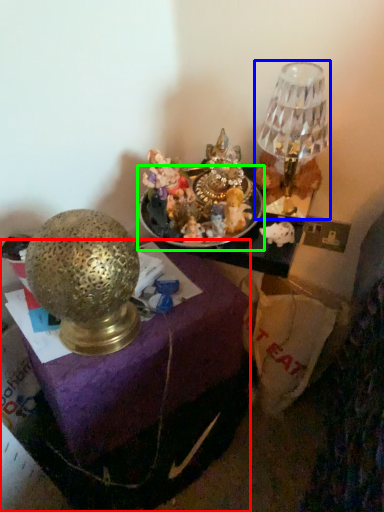
Question: Estimate the real-world distances between objects in this image. Which object is farther from furniture (highlighted by a red box), lamp (highlighted by a blue box) or tableware (highlighted by a green box)?

Choices:
 (A) lamp
 (B) tableware

Answer: (A)